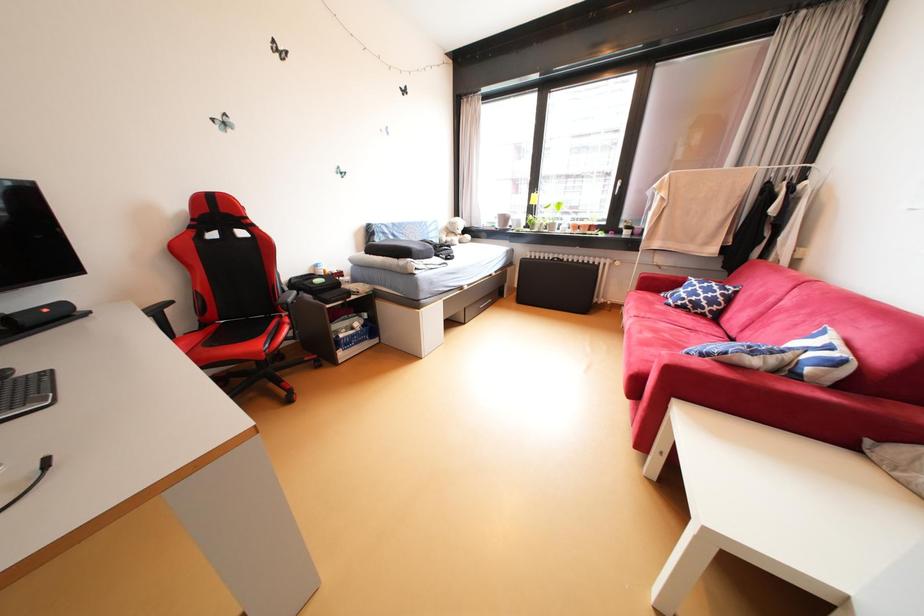
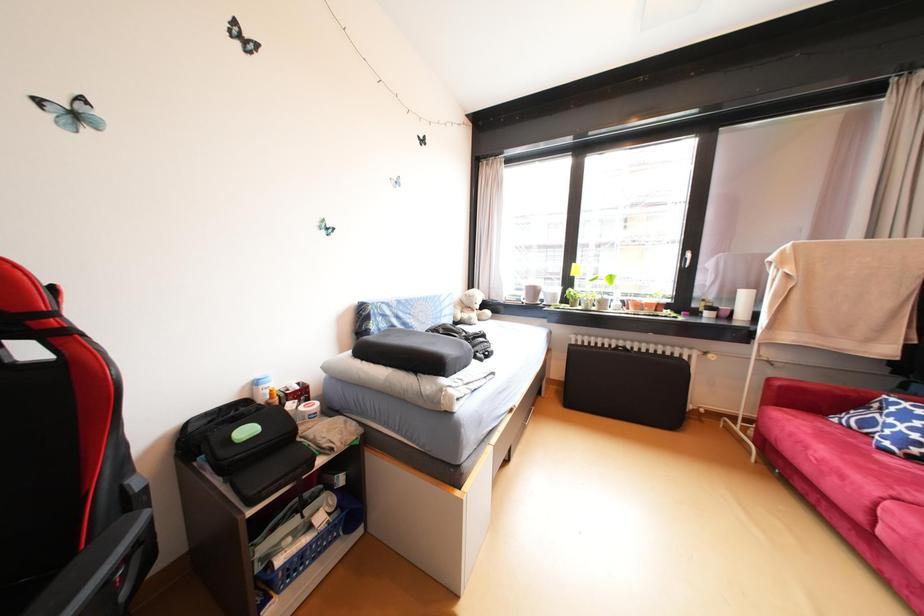
Which direction would the cameraman need to move to produce the second image?

The movement direction of the cameraman is left, forward.